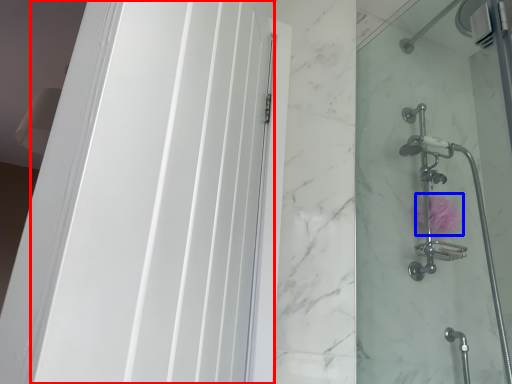
Question: Which object is closer to the camera taking this photo, screen door (highlighted by a red box) or flower (highlighted by a blue box)?

Choices:
 (A) screen door
 (B) flower

Answer: (A)